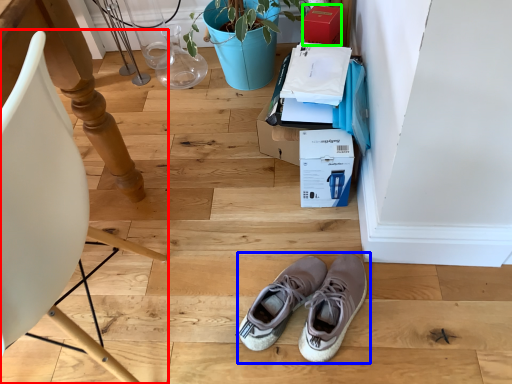
Question: Which object is positioned closest to chair (highlighted by a red box)? Select from footwear (highlighted by a blue box) and cardboard box (highlighted by a green box).

Choices:
 (A) footwear
 (B) cardboard box

Answer: (A)